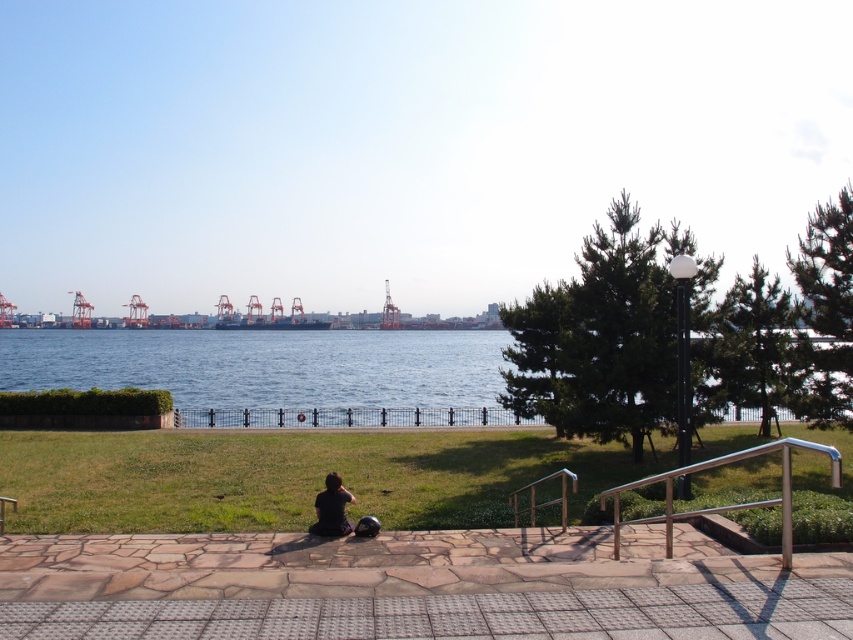
Can you confirm if blue water at center is positioned below black metal fence at center?

No.

Is point (305, 355) closer to viewer compared to point (463, 413)?

No, it is not.

You are a GUI agent. You are given a task and a screenshot of the screen. Output one action in this format:
    pyautogui.click(x=<x>, y=<y>)
    Task: Click on the blue water at center
    The image size is (853, 640).
    Given the screenshot: What is the action you would take?
    pyautogui.click(x=276, y=372)

Where is `black metal fence at center`? black metal fence at center is located at coordinates (349, 417).

Is point (344, 416) more distant than point (326, 484)?

Yes.

The width and height of the screenshot is (853, 640). What do you see at coordinates (349, 417) in the screenshot? I see `black metal fence at center` at bounding box center [349, 417].

Locate an element on the screen. black metal fence at center is located at coordinates (349, 417).

Is blue water at center positioned at the back of black fabric person at center?

Yes.

Which is above, blue water at center or black fabric person at center?

blue water at center is above.

Is point (221, 372) positioned in front of point (354, 500)?

No, (221, 372) is behind (354, 500).

Where is `blue water at center`? blue water at center is located at coordinates (276, 372).